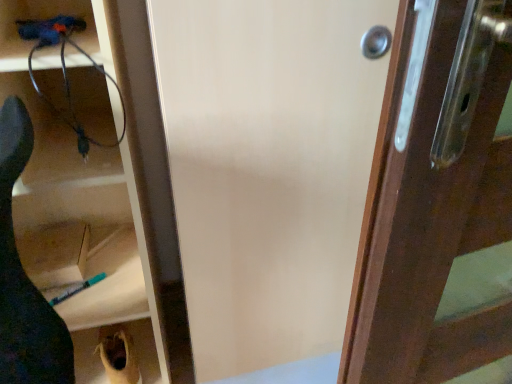
Question: Considering the relative sizes of matte plastic cabinet at left, marked as the 1th cabinetry in a top-to-bottom arrangement, and dark brown wood at right in the image provided, is matte plastic cabinet at left, marked as the 1th cabinetry in a top-to-bottom arrangement, wider than dark brown wood at right?

Choices:
 (A) yes
 (B) no

Answer: (B)

Question: Is dark brown wood at right surrounded by matte plastic cabinet at left, marked as the 1th cabinetry in a top-to-bottom arrangement?

Choices:
 (A) yes
 (B) no

Answer: (B)

Question: Is matte plastic cabinet at left, marked as the 1th cabinetry in a top-to-bottom arrangement, not within dark brown wood at right?

Choices:
 (A) yes
 (B) no

Answer: (A)

Question: Could you tell me if matte plastic cabinet at left, acting as the second cabinetry starting from the bottom, is facing dark brown wood at right?

Choices:
 (A) no
 (B) yes

Answer: (A)

Question: Is the position of matte plastic cabinet at left, acting as the second cabinetry starting from the bottom, less distant than that of dark brown wood at right?

Choices:
 (A) yes
 (B) no

Answer: (B)

Question: Looking at the image, does dark brown wood at right seem bigger or smaller compared to matte plastic cabinet at left, acting as the second cabinetry starting from the bottom?

Choices:
 (A) small
 (B) big

Answer: (A)

Question: Is point (412, 266) positioned closer to the camera than point (165, 281)?

Choices:
 (A) closer
 (B) farther

Answer: (A)

Question: Relative to matte plastic cabinet at left, acting as the second cabinetry starting from the bottom, is dark brown wood at right in front or behind?

Choices:
 (A) front
 (B) behind

Answer: (A)

Question: Would you say dark brown wood at right is to the left or to the right of matte plastic cabinet at left, marked as the 1th cabinetry in a top-to-bottom arrangement, in the picture?

Choices:
 (A) right
 (B) left

Answer: (A)

Question: From the image's perspective, is black matte shoe at lower left positioned above or below matte wood screen door at center?

Choices:
 (A) above
 (B) below

Answer: (B)

Question: Considering the positions of black matte shoe at lower left and matte wood screen door at center in the image, is black matte shoe at lower left taller or shorter than matte wood screen door at center?

Choices:
 (A) tall
 (B) short

Answer: (B)

Question: Is black matte shoe at lower left wider or thinner than matte wood screen door at center?

Choices:
 (A) wide
 (B) thin

Answer: (B)

Question: Based on their sizes in the image, would you say black matte shoe at lower left is bigger or smaller than matte wood screen door at center?

Choices:
 (A) small
 (B) big

Answer: (A)

Question: From the image's perspective, relative to black matte shoe at lower left, is brown fabric bag at lower left, which is the second cabinetry in top-to-bottom order, above or below?

Choices:
 (A) above
 (B) below

Answer: (B)

Question: Relative to black matte shoe at lower left, is brown fabric bag at lower left, which is the second cabinetry in top-to-bottom order, in front or behind?

Choices:
 (A) behind
 (B) front

Answer: (A)